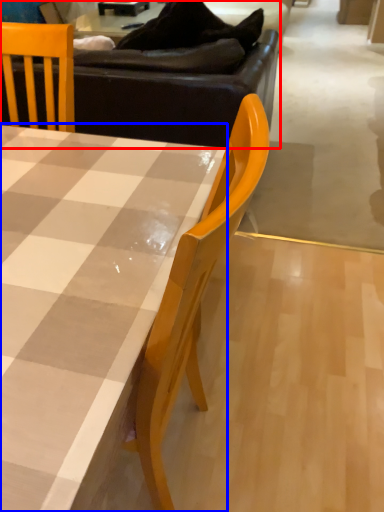
Question: Which of the following is the farthest to the observer, studio couch (highlighted by a red box) or table (highlighted by a blue box)?

Choices:
 (A) studio couch
 (B) table

Answer: (A)